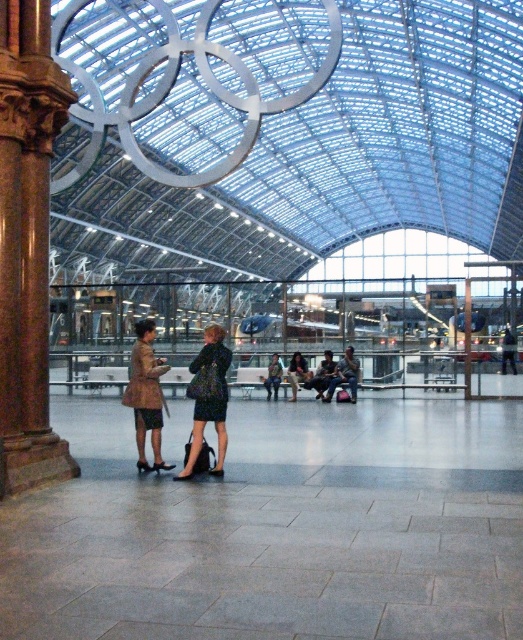
Can you confirm if brown stone column at left is positioned to the left of leather jacket at center?

Correct, you'll find brown stone column at left to the left of leather jacket at center.

Locate an element on the screen. brown stone column at left is located at coordinates (27, 243).

How far apart are brown stone column at left and dark blue fabric jacket at center?

brown stone column at left and dark blue fabric jacket at center are 14.48 meters apart from each other.

The width and height of the screenshot is (523, 640). I want to click on brown stone column at left, so click(27, 243).

Does point (14, 266) come closer to viewer compared to point (505, 353)?

Yes, point (14, 266) is in front of point (505, 353).

Identify the location of brown stone column at left. (27, 243).

Can you confirm if camouflage fabric jacket at center is taller than dark green fabric jacket at center?

Yes, camouflage fabric jacket at center is taller than dark green fabric jacket at center.

What do you see at coordinates (345, 376) in the screenshot? This screenshot has width=523, height=640. I see `camouflage fabric jacket at center` at bounding box center [345, 376].

Where is `camouflage fabric jacket at center`? The height and width of the screenshot is (640, 523). camouflage fabric jacket at center is located at coordinates (345, 376).